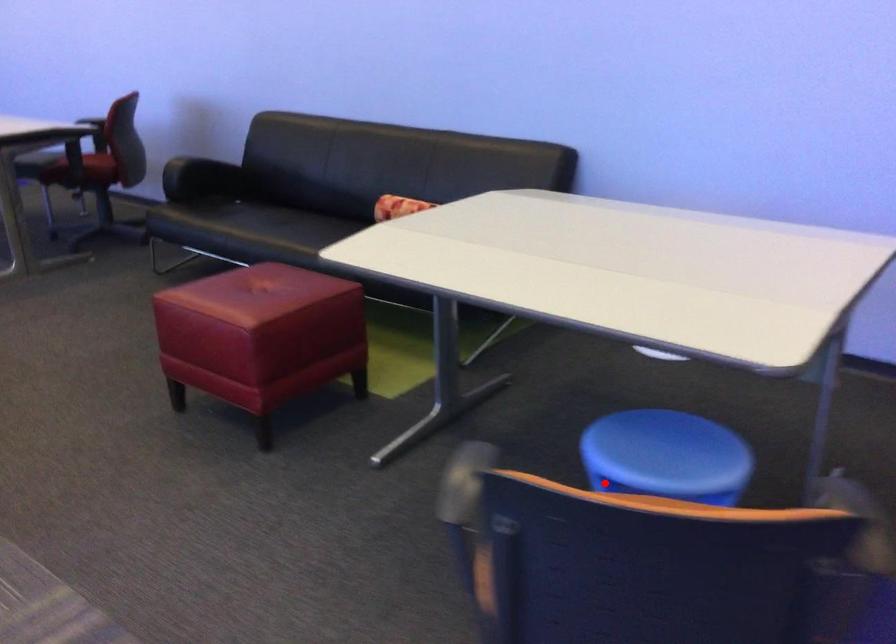
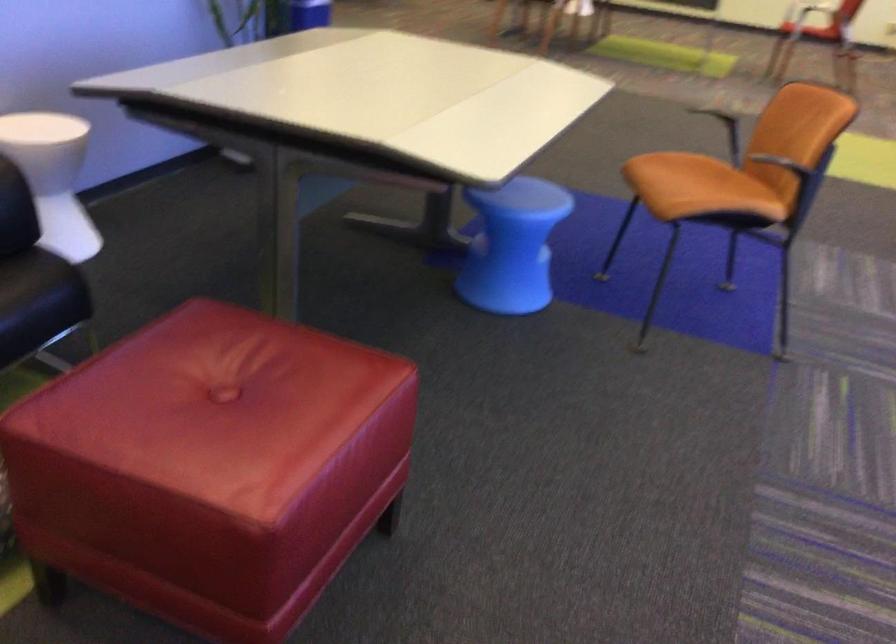
Question: A red point is marked in image1. In image2, is the corresponding 3D point closer to the camera or farther? Reply with the corresponding letter.

Choices:
 (A) The corresponding 3D point is closer.
 (B) The corresponding 3D point is farther.

Answer: (B)